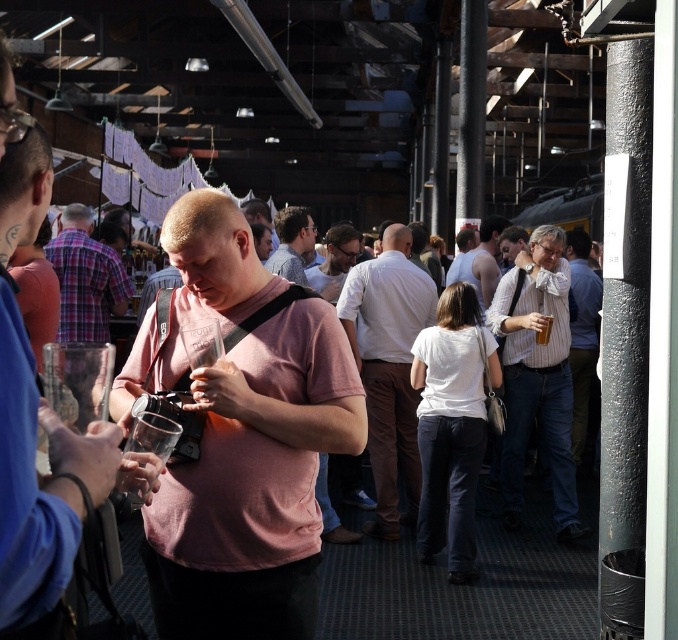
You are organizing a clothing display and need to arrange the white striped shirt at right and the skinny white tank top at center based on their sizes. Which one should you place on the wider hanger?

The white striped shirt at right should be placed on the wider hanger because its width is larger than the skinny white tank top at center.

You are standing in the middle of the hall and see two points marked in the image. Which point is nearer to you, point [582,317] or point [296,205]?

Point [582,317] is closer to the viewer than point [296,205].

You are standing in the scene and want to hand a drink to the person wearing the striped shirt at right. Considering your arm length is 2 feet, can you reach them without moving?

The distance between you and the striped shirt at right is 21.31 feet, which is much greater than your 2 feet arm length. You cannot reach them without moving closer.